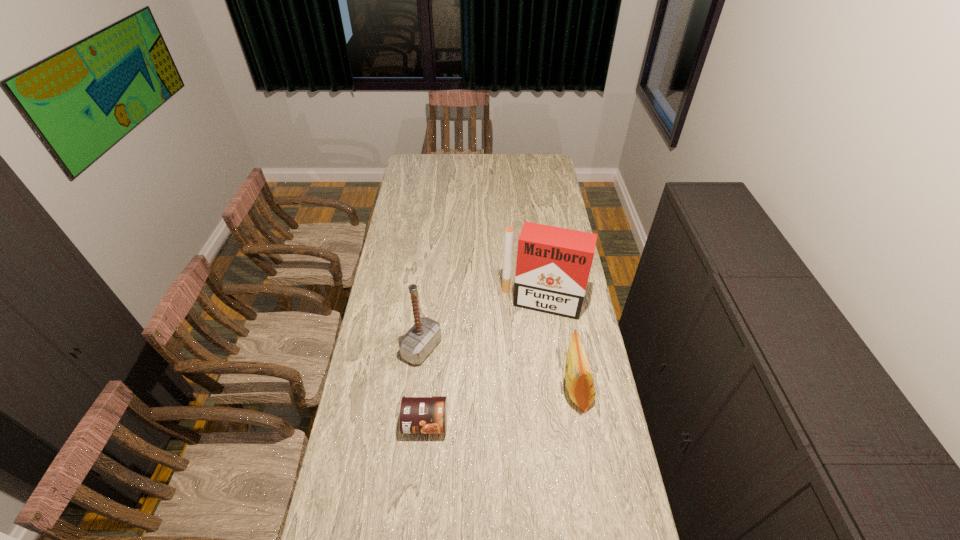
The image size is (960, 540). I want to click on vacant space on the desktop that is between the shortest object and the second shortest object and is positioned on the front-facing side of the farthest object, so click(516, 403).

Where is `free spot on the desktop that is between the can and the third tallest object and is positioned on the striking surface of the second farthest object`? free spot on the desktop that is between the can and the third tallest object and is positioned on the striking surface of the second farthest object is located at coordinates (523, 402).